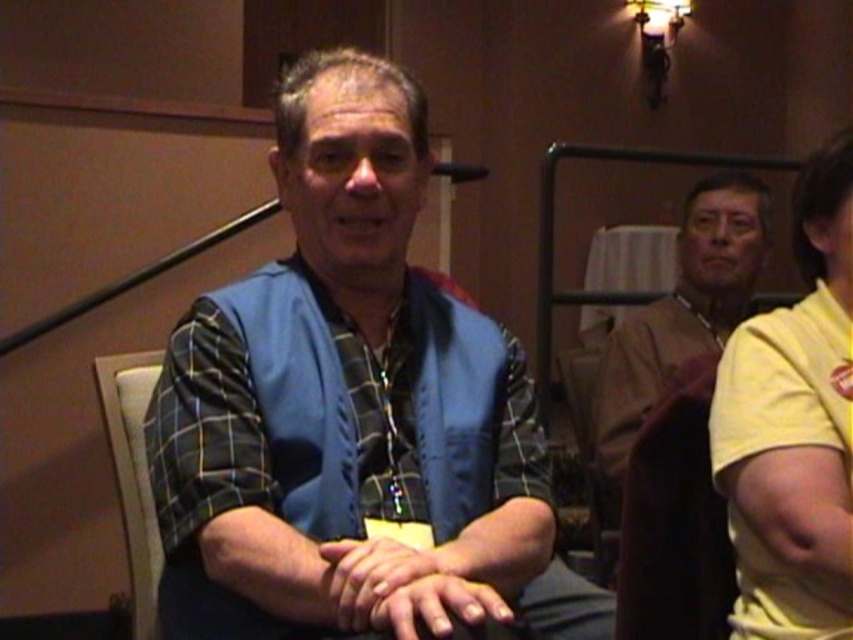
Does yellow matte shirt at right have a greater width compared to light beige fabric chair at lower left?

Indeed, yellow matte shirt at right has a greater width compared to light beige fabric chair at lower left.

Between point (737, 621) and point (102, 412), which one is positioned in front?

Positioned in front is point (737, 621).

Is point (773, 344) positioned in front of point (106, 371)?

Yes, it is.

This screenshot has height=640, width=853. I want to click on yellow matte shirt at right, so click(793, 428).

Who is more forward, (579, 577) or (759, 339)?

Point (759, 339) is in front.

Does point (312, 376) lie behind point (770, 508)?

Yes, point (312, 376) is behind point (770, 508).

The height and width of the screenshot is (640, 853). Find the location of `blue fabric vest at center`. blue fabric vest at center is located at coordinates (351, 410).

Which is behind, point (834, 328) or point (628, 376)?

Positioned behind is point (628, 376).

Is yellow matte shirt at right in front of brown leather jacket at upper right?

That is True.

Is point (816, 490) positioned in front of point (682, 230)?

Yes, it is in front of point (682, 230).

Find the location of a particular element. Image resolution: width=853 pixels, height=640 pixels. yellow matte shirt at right is located at coordinates (793, 428).